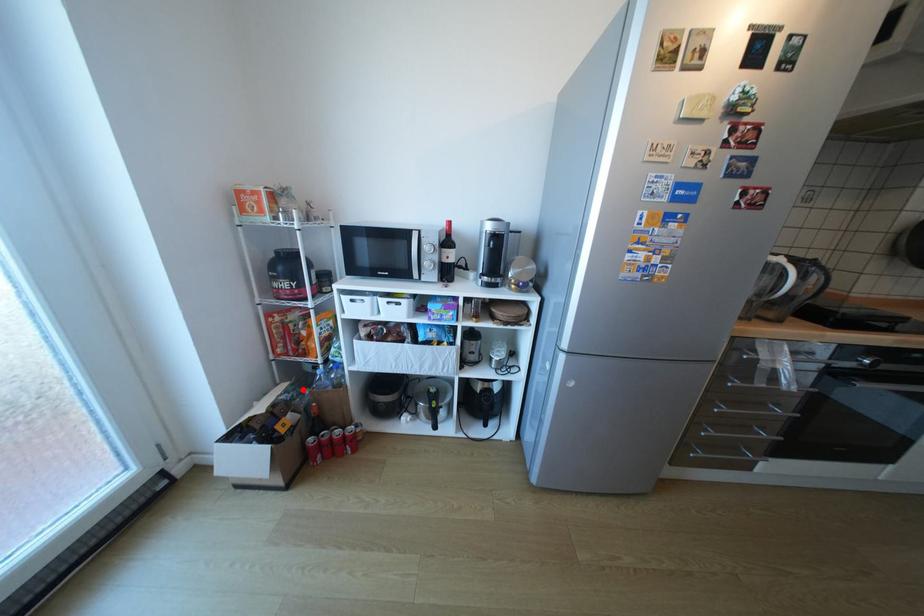
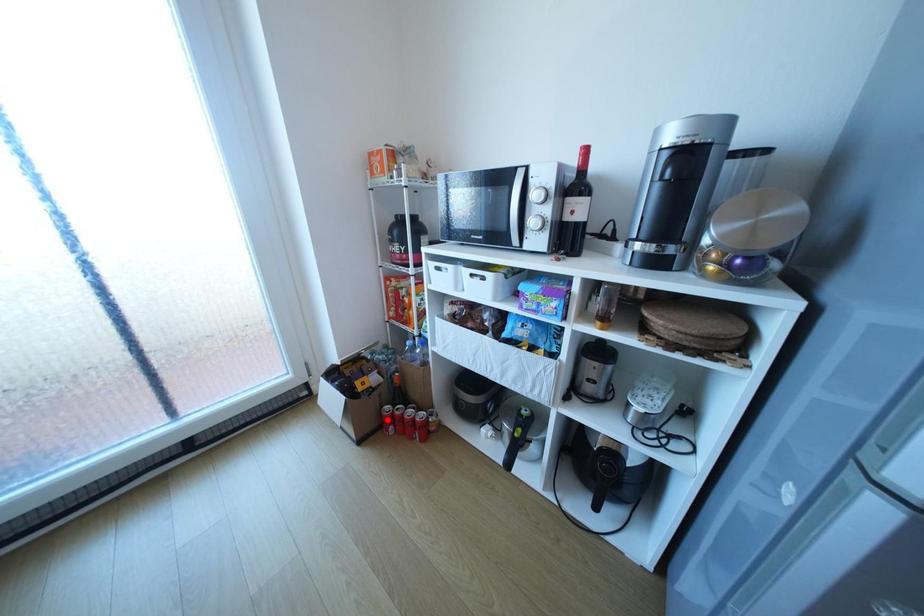
I am providing you with two images of the same scene from different viewpoints. A red point is marked on the first image and another point is marked on the second image. Is the red point in image1 aligned with the point shown in image2?

No